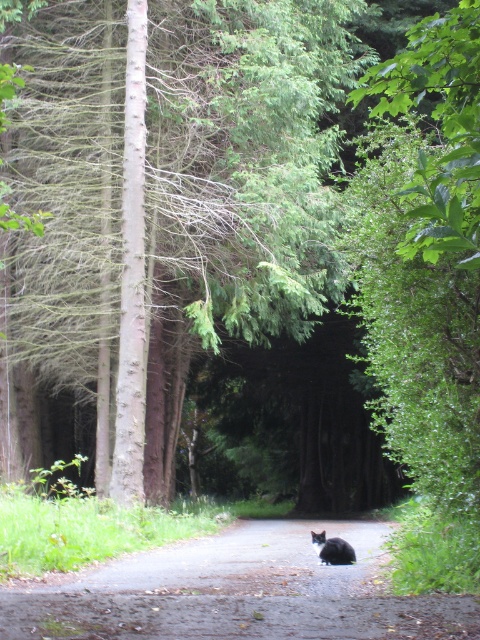
Can you confirm if brown rough tree at center is positioned to the right of dirt road at center?

In fact, brown rough tree at center is to the left of dirt road at center.

Between point (312, 22) and point (305, 550), which one is positioned in front?

Positioned in front is point (305, 550).

The width and height of the screenshot is (480, 640). In order to click on brown rough tree at center in this screenshot , I will do `click(242, 163)`.

Is dirt road at center bigger than black fur cat at center?

Yes, dirt road at center is bigger than black fur cat at center.

Is dirt road at center below black fur cat at center?

Correct, dirt road at center is located below black fur cat at center.

Which is in front, point (384, 624) or point (317, 554)?

Point (384, 624) is more forward.

Locate an element on the screen. Image resolution: width=480 pixels, height=640 pixels. dirt road at center is located at coordinates (237, 593).

In the scene shown: Does brown rough tree at center have a lesser height compared to black fur cat at center?

Incorrect, brown rough tree at center's height does not fall short of black fur cat at center's.

Is point (228, 17) positioned before point (322, 557)?

No, (228, 17) is further to viewer.

What are the coordinates of `brown rough tree at center` in the screenshot? It's located at (242, 163).

Identify the location of brown rough tree at center. (242, 163).